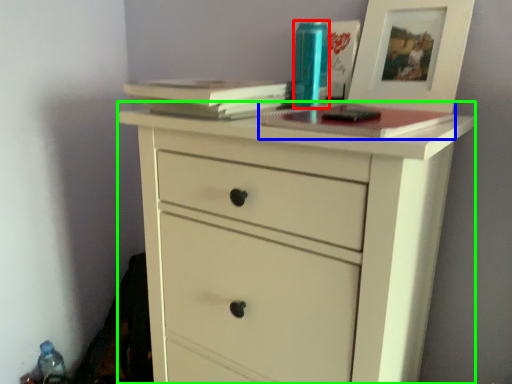
Question: Which is farther away from bottle (highlighted by a red box)? paperback book (highlighted by a blue box) or chest of drawers (highlighted by a green box)?

Choices:
 (A) paperback book
 (B) chest of drawers

Answer: (B)